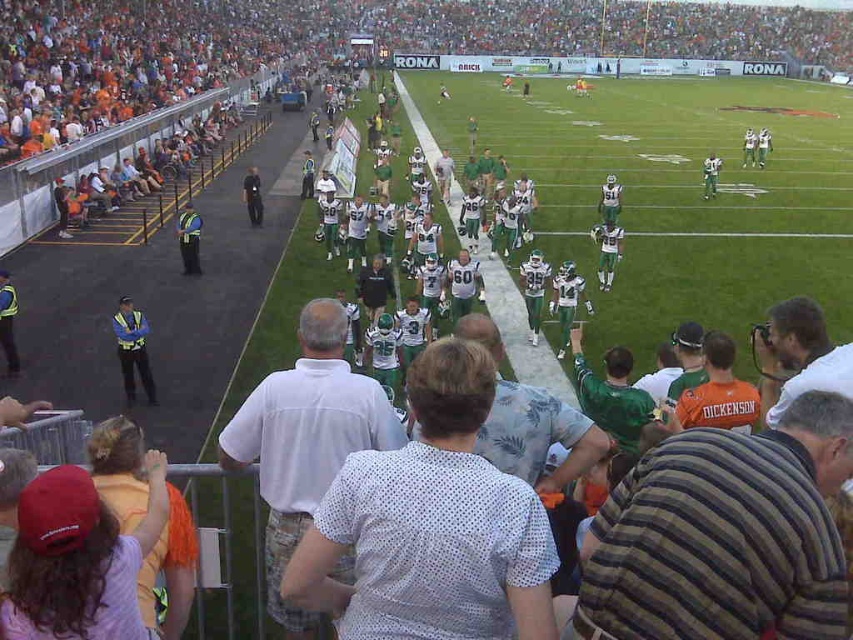
You are a photographer positioned at the edge of the field. You want to take a photo that includes both the reflective yellow vest at left and the white jersey at center. Based on their positions, which object should you adjust your camera to focus on first to ensure both are in frame?

The reflective yellow vest at left is to the left of white jersey at center, so you should focus on the reflective yellow vest at left first to ensure both are in frame.

You are a photographer standing at the camera position. You want to capture a closeup shot of the reflective yellow vest at center. Given that your camera can focus on objects within 20 meters, will you be able to take the photo without moving closer?

The reflective yellow vest at center is 23.01 meters from the camera, which is beyond the camera focus range of 20 meters. Therefore, you cannot take a clear closeup shot without moving closer.